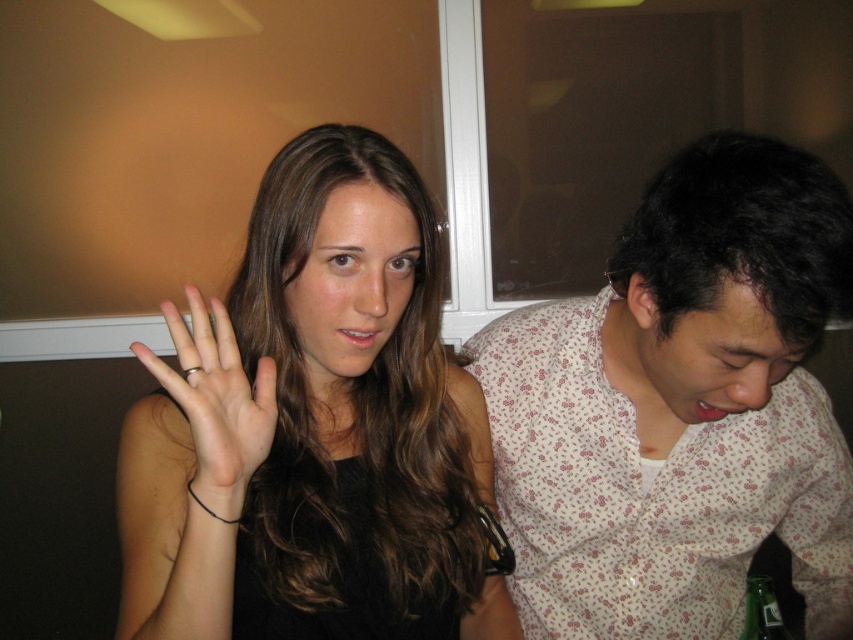
Question: Which point is farther to the camera?

Choices:
 (A) (543, 554)
 (B) (410, 532)
 (C) (218, 408)

Answer: (A)

Question: Does matte black hand at center lie in front of white floral shirt at right?

Choices:
 (A) yes
 (B) no

Answer: (A)

Question: Among these objects, which one is nearest to the camera?

Choices:
 (A) gold metallic ring at center
 (B) matte black hand at center

Answer: (B)

Question: From the image, what is the correct spatial relationship of white floral shirt at right in relation to gold metallic ring at center?

Choices:
 (A) above
 (B) below

Answer: (B)

Question: Which point is closer to the camera?

Choices:
 (A) [227, 360]
 (B) [426, 484]
 (C) [531, 356]

Answer: (A)

Question: Does white floral shirt at right come in front of gold metallic ring at center?

Choices:
 (A) yes
 (B) no

Answer: (B)